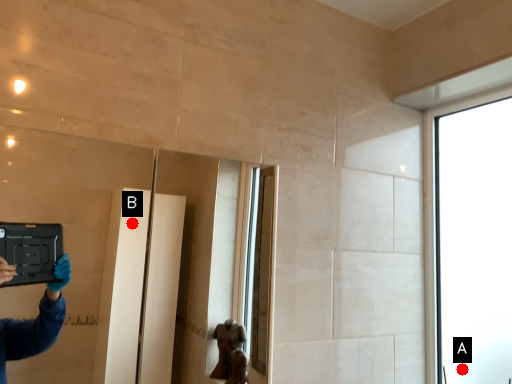
Question: Two points are circled on the image, labeled by A and B beside each circle. Among these points, which one is farthest from the camera?

Choices:
 (A) A is further
 (B) B is further

Answer: (B)